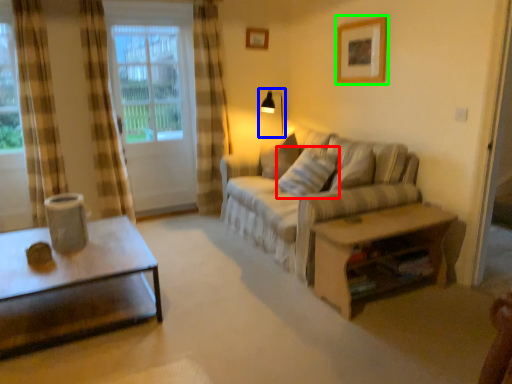
Question: Estimate the real-world distances between objects in this image. Which object is closer to pillow (highlighted by a red box), table lamp (highlighted by a blue box) or picture frame (highlighted by a green box)?

Choices:
 (A) table lamp
 (B) picture frame

Answer: (B)